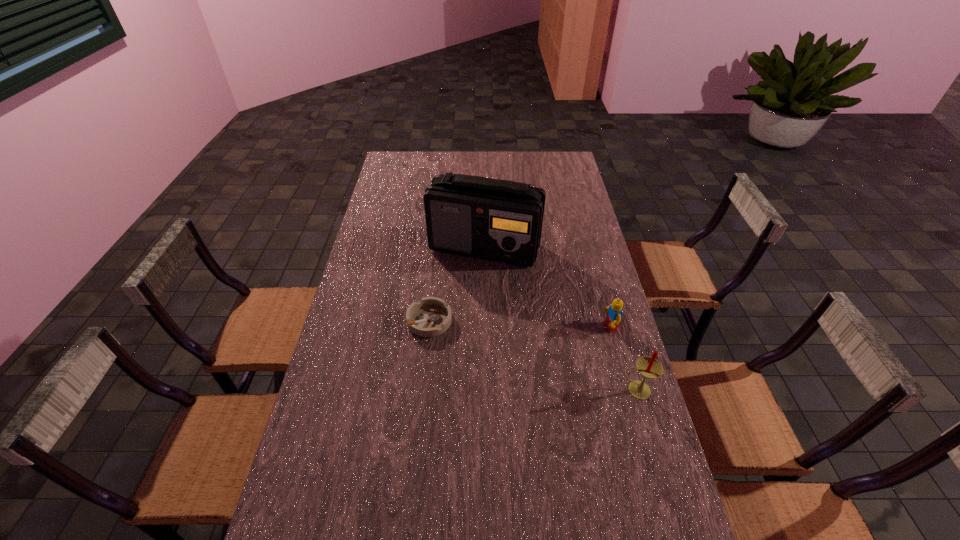
Identify the location of vacant space at the near right corner of the desktop. (611, 514).

Identify the location of empty space that is in between the tallest object and the ashtray. Image resolution: width=960 pixels, height=540 pixels. (457, 284).

Where is `free spot between the second shortest object and the ashtray`? This screenshot has height=540, width=960. free spot between the second shortest object and the ashtray is located at coordinates (519, 324).

Locate an element on the screen. The width and height of the screenshot is (960, 540). free space that is in between the ashtray and the farthest object is located at coordinates (457, 284).

Where is `free area in between the shortest object and the nearest object`? The height and width of the screenshot is (540, 960). free area in between the shortest object and the nearest object is located at coordinates (533, 355).

Locate an element on the screen. free spot between the tallest object and the Lego is located at coordinates (546, 288).

This screenshot has width=960, height=540. Find the location of `vacant area that lies between the ashtray and the Lego`. vacant area that lies between the ashtray and the Lego is located at coordinates (519, 324).

This screenshot has height=540, width=960. Identify the location of free spot between the third tallest object and the candle. (623, 359).

This screenshot has width=960, height=540. Identify the location of empty location between the second shortest object and the radio receiver. (546, 288).

The image size is (960, 540). In order to click on free space that is in between the nearest object and the farthest object in this screenshot , I will do `click(561, 319)`.